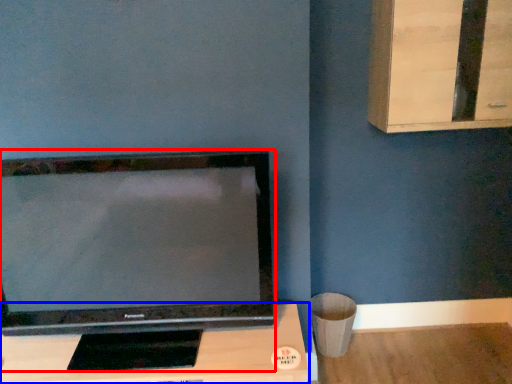
Question: Which object is further to the camera taking this photo, television (highlighted by a red box) or furniture (highlighted by a blue box)?

Choices:
 (A) television
 (B) furniture

Answer: (B)